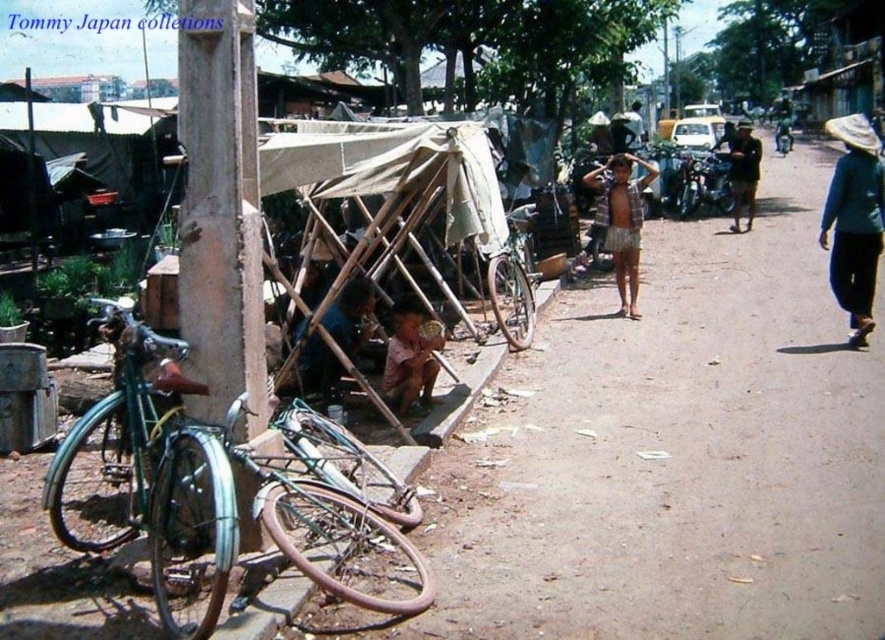
This screenshot has height=640, width=885. What do you see at coordinates (210, 497) in the screenshot?
I see `green metallic bicycle at lower left` at bounding box center [210, 497].

Is point (114, 400) farther from camera compared to point (712, 202)?

No, (114, 400) is in front of (712, 202).

The width and height of the screenshot is (885, 640). What are the coordinates of `green metallic bicycle at lower left` in the screenshot? It's located at (210, 497).

From the picture: Can you confirm if plaid shirt at center is positioned below dark blue fabric at center?

No.

Is plaid shirt at center wider than dark blue fabric at center?

Yes, plaid shirt at center is wider than dark blue fabric at center.

You are a GUI agent. You are given a task and a screenshot of the screen. Output one action in this format:
    pyautogui.click(x=<x>, y=<y>)
    Task: Click on the plaid shirt at center
    This screenshot has height=640, width=885.
    Given the screenshot: What is the action you would take?
    pyautogui.click(x=622, y=220)

Is green metallic bicycle at lower left wider than blue fabric hat at right?

In fact, green metallic bicycle at lower left might be narrower than blue fabric hat at right.

Where is `green metallic bicycle at lower left`? The image size is (885, 640). green metallic bicycle at lower left is located at coordinates (210, 497).